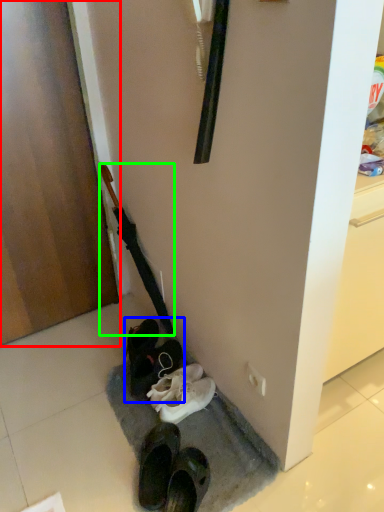
Question: Estimate the real-world distances between objects in this image. Which object is farther from door (highlighted by a red box), footwear (highlighted by a blue box) or umbrella (highlighted by a green box)?

Choices:
 (A) footwear
 (B) umbrella

Answer: (A)